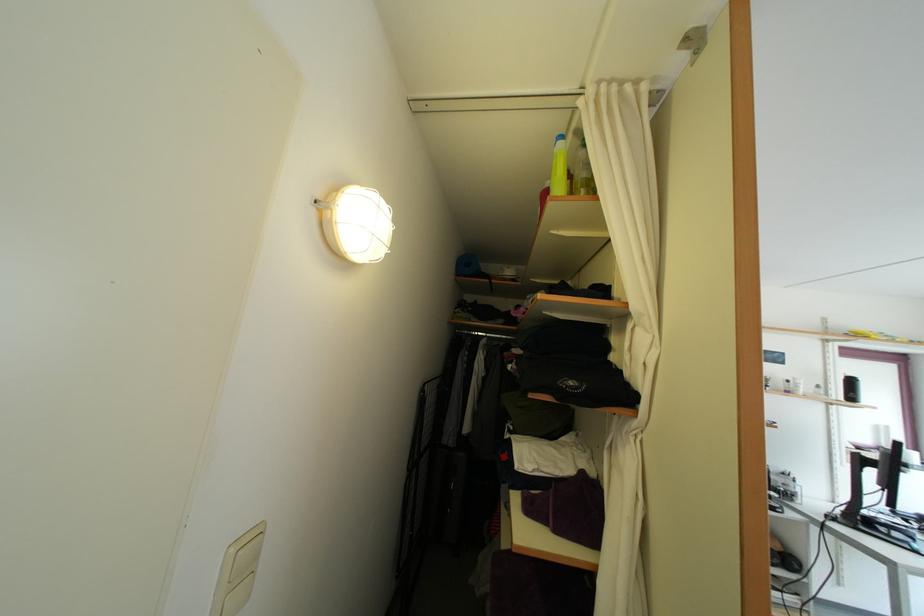
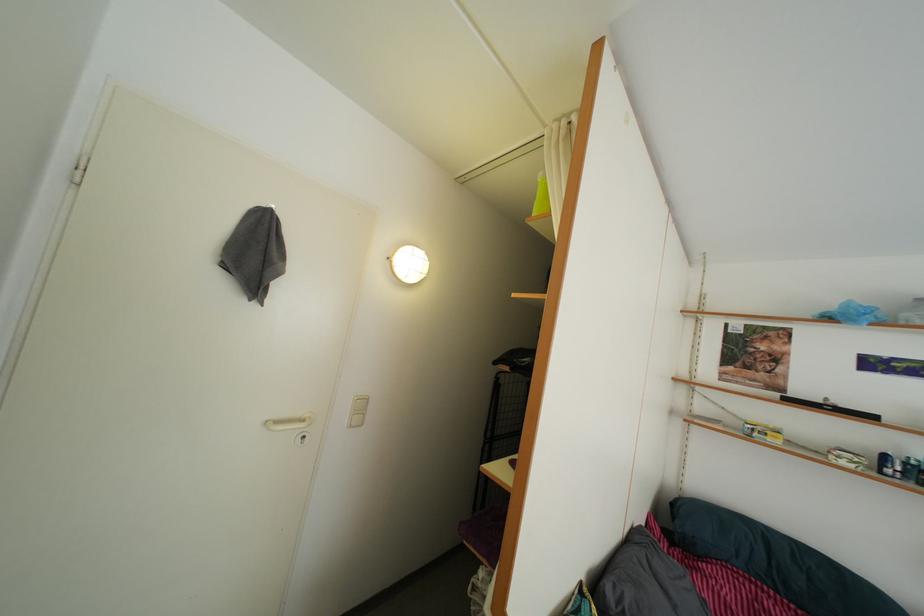
Question: The images are taken continuously from a first-person perspective. In which direction is your viewpoint rotating?

Choices:
 (A) Left
 (B) Right
 (C) Up
 (D) Down

Answer: (A)